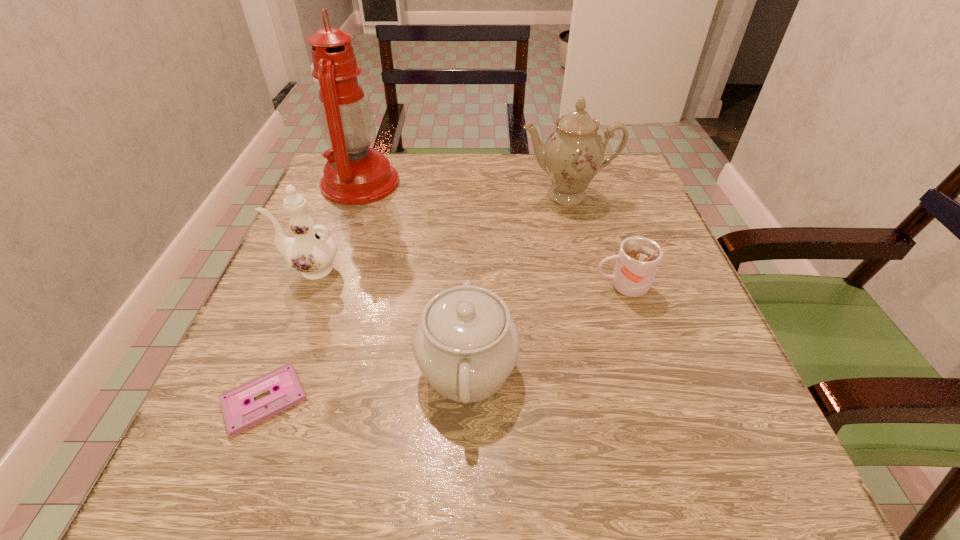
The image size is (960, 540). Identify the location of chinaware located in the left edge section of the desktop. (312, 251).

This screenshot has width=960, height=540. Identify the location of videotape located in the left edge section of the desktop. (239, 415).

Image resolution: width=960 pixels, height=540 pixels. I want to click on chinaware located at the right edge, so click(573, 154).

Find the location of a particular element. cup located at the right edge is located at coordinates (637, 262).

Where is `object present at the far left corner`? This screenshot has width=960, height=540. object present at the far left corner is located at coordinates (354, 174).

What are the coordinates of `object that is at the near left corner` in the screenshot? It's located at (239, 415).

The width and height of the screenshot is (960, 540). I want to click on object located at the far right corner, so click(x=573, y=154).

In the image, there is a desktop. Identify the location of vacant space at the far edge. (427, 182).

Locate an element on the screen. This screenshot has height=540, width=960. free region at the near edge of the desktop is located at coordinates (497, 455).

Locate an element on the screen. This screenshot has width=960, height=540. vacant space at the left edge of the desktop is located at coordinates (265, 299).